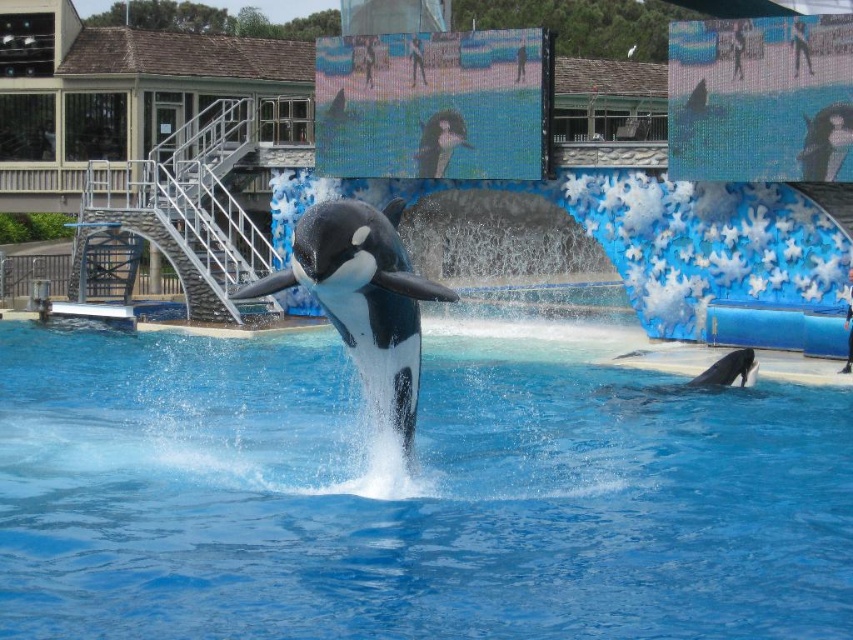
Question: Which point appears farthest from the camera in this image?

Choices:
 (A) (358, 440)
 (B) (746, 348)

Answer: (B)

Question: Which of these objects is positioned farthest from the blue smooth water at center?

Choices:
 (A) smooth gray dolphin at lower right
 (B) black smooth orca at center

Answer: (A)

Question: Estimate the real-world distances between objects in this image. Which object is closer to the blue smooth water at center?

Choices:
 (A) smooth gray dolphin at lower right
 (B) black smooth orca at center

Answer: (B)

Question: Is black smooth orca at center in front of smooth gray dolphin at lower right?

Choices:
 (A) no
 (B) yes

Answer: (B)

Question: Can you confirm if black smooth orca at center is bigger than smooth gray dolphin at lower right?

Choices:
 (A) yes
 (B) no

Answer: (A)

Question: Considering the relative positions of blue smooth water at center and smooth gray dolphin at lower right in the image provided, where is blue smooth water at center located with respect to smooth gray dolphin at lower right?

Choices:
 (A) left
 (B) right

Answer: (A)